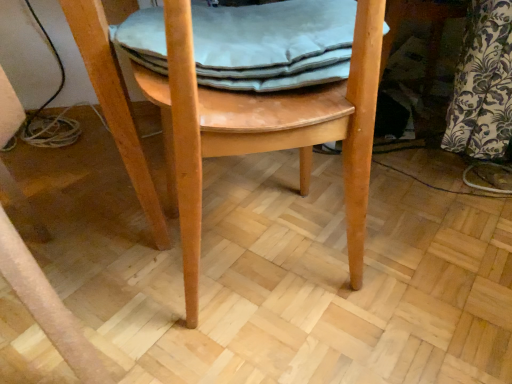
Question: Considering the relative sizes of light brown wood chair at center and light gray fabric cushion at center in the image provided, is light brown wood chair at center smaller than light gray fabric cushion at center?

Choices:
 (A) no
 (B) yes

Answer: (A)

Question: From a real-world perspective, is light brown wood chair at center on light gray fabric cushion at center?

Choices:
 (A) yes
 (B) no

Answer: (B)

Question: Are light brown wood chair at center and light gray fabric cushion at center located far from each other?

Choices:
 (A) yes
 (B) no

Answer: (B)

Question: From the image's perspective, is light brown wood chair at center on top of light gray fabric cushion at center?

Choices:
 (A) no
 (B) yes

Answer: (A)

Question: Does light brown wood chair at center turn towards light gray fabric cushion at center?

Choices:
 (A) yes
 (B) no

Answer: (A)

Question: From the image's perspective, does light brown wood chair at center appear lower than light gray fabric cushion at center?

Choices:
 (A) no
 (B) yes

Answer: (B)

Question: From the image's perspective, is light gray fabric cushion at center below light brown wood chair at center?

Choices:
 (A) no
 (B) yes

Answer: (A)

Question: Is light brown wood chair at center surrounded by light gray fabric cushion at center?

Choices:
 (A) yes
 (B) no

Answer: (B)

Question: Does light gray fabric cushion at center have a lesser height compared to light brown wood chair at center?

Choices:
 (A) no
 (B) yes

Answer: (B)

Question: Can you confirm if light gray fabric cushion at center is bigger than light brown wood chair at center?

Choices:
 (A) no
 (B) yes

Answer: (A)

Question: Does light gray fabric cushion at center have a greater height compared to light brown wood chair at center?

Choices:
 (A) no
 (B) yes

Answer: (A)

Question: Is light gray fabric cushion at center aimed at light brown wood chair at center?

Choices:
 (A) no
 (B) yes

Answer: (B)

Question: Is light brown wood chair at center spatially inside light gray fabric cushion at center, or outside of it?

Choices:
 (A) outside
 (B) inside

Answer: (A)